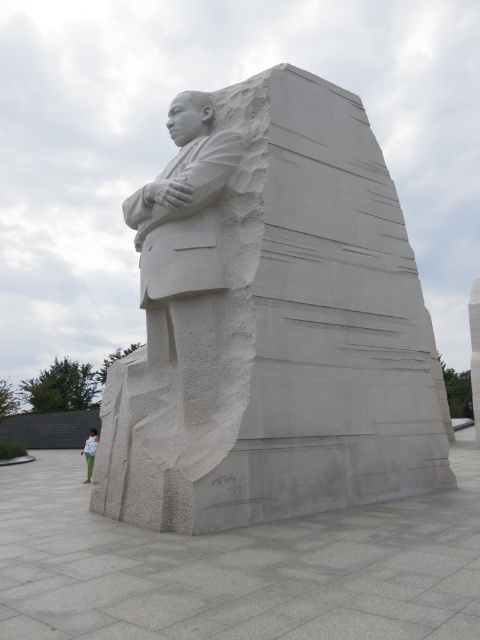
How distant is white stone statue at center from green fabric pants at lower left?

11.90 meters

Is white stone statue at center bigger than green fabric pants at lower left?

Actually, white stone statue at center might be smaller than green fabric pants at lower left.

The image size is (480, 640). In order to click on white stone statue at center in this screenshot , I will do `click(271, 321)`.

In order to click on white stone statue at center in this screenshot , I will do `click(271, 321)`.